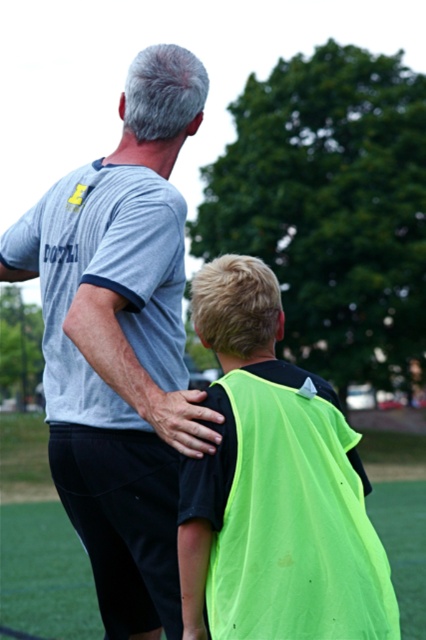
Question: Can you confirm if gray cotton t-shirt at upper left is positioned below neon green fabric at center?

Choices:
 (A) yes
 (B) no

Answer: (B)

Question: Which object is the farthest from the gray cotton t-shirt at upper left?

Choices:
 (A) neon green fabric at center
 (B) neon yellow vest at center

Answer: (A)

Question: Which point is farther from the camera taking this photo?

Choices:
 (A) (97, 244)
 (B) (244, 592)
 (C) (411, 582)

Answer: (C)

Question: Does gray cotton t-shirt at upper left have a smaller size compared to neon yellow vest at center?

Choices:
 (A) yes
 (B) no

Answer: (B)

Question: Is gray cotton t-shirt at upper left smaller than neon green fabric at center?

Choices:
 (A) yes
 (B) no

Answer: (A)

Question: Which object is closer to the camera taking this photo?

Choices:
 (A) neon yellow vest at center
 (B) gray cotton t-shirt at upper left
 (C) neon green fabric at center

Answer: (A)